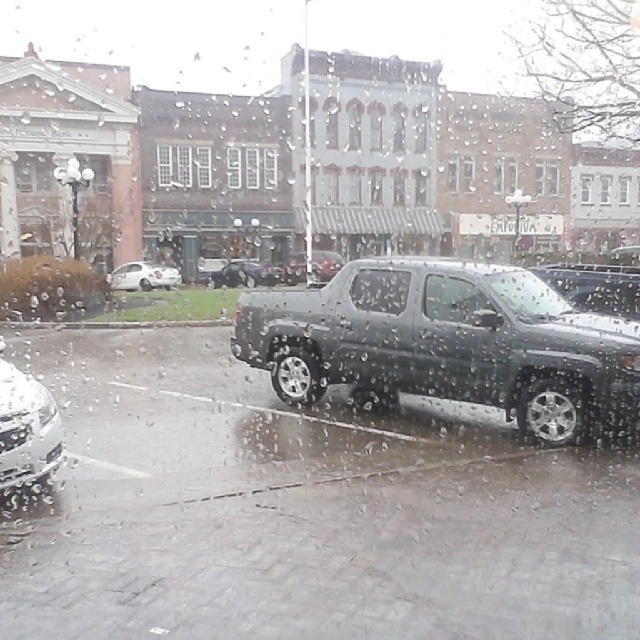
You are standing at the point with coordinates (448, 344) in the image. What object is located exactly at this point?

The point at coordinates (448, 344) indicates the metallic gray pickup truck at center.

You are a delivery driver who needs to park your van between the two trucks in the image. The van is 6 meters long. Can you fit it between the metallic gray pickup truck at center and the metallic silver truck at center?

The metallic gray pickup truck at center is positioned on the right side of the metallic silver truck at center, but the distance between them isn not provided. Without knowing the space between the two trucks, it is impossible to determine if the van will fit.

You are a delivery driver who needs to park your vehicle between the metallic gray pickup truck at center and the metallic silver truck at center. Given that your vehicle is 5 meters long, can you safely park in this space?

The metallic gray pickup truck at center is smaller than the metallic silver truck at center, but the exact distance between them isn